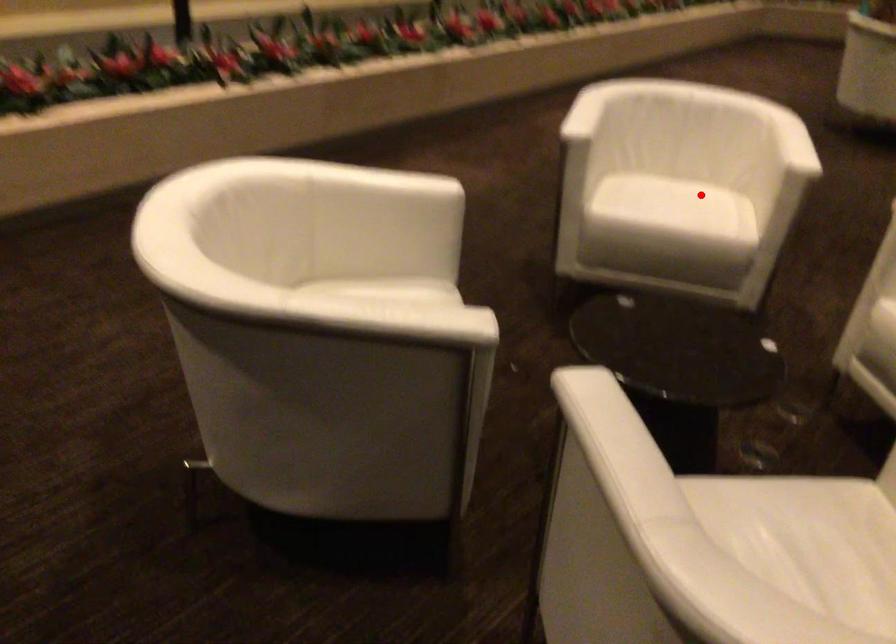
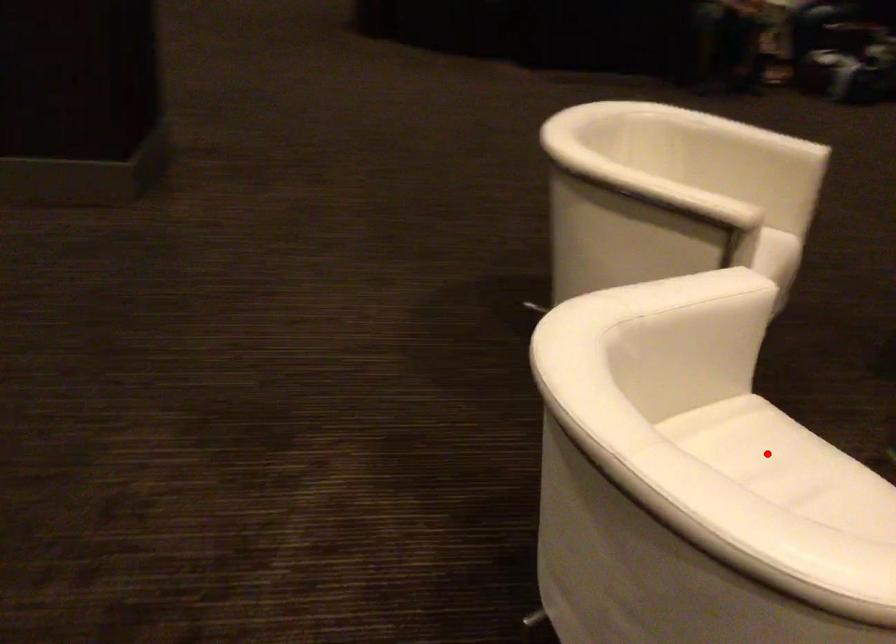
I am providing you with two images of the same scene from different viewpoints. A red point is marked on the first image and another point is marked on the second image. Does the point marked in image1 correspond to the same location as the one in image2?

Yes